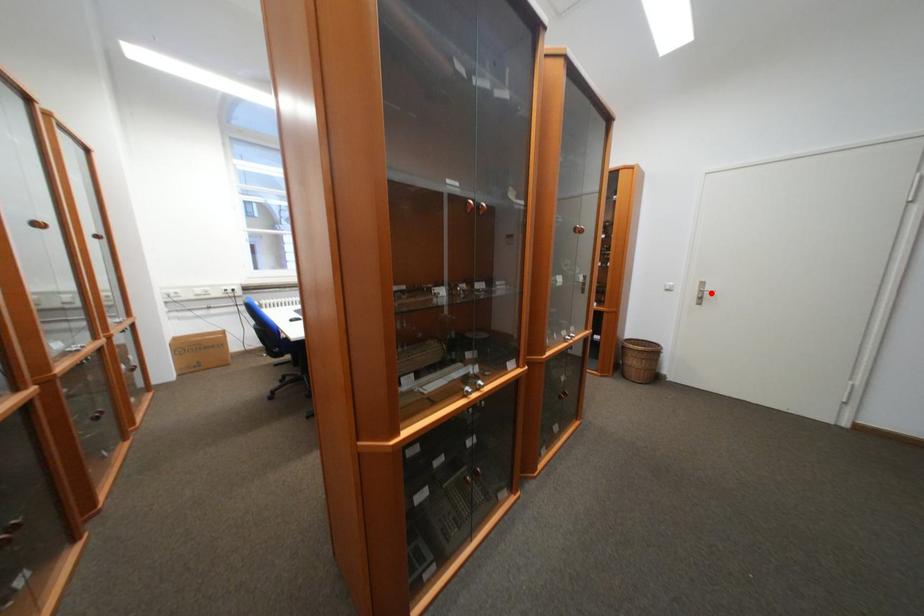
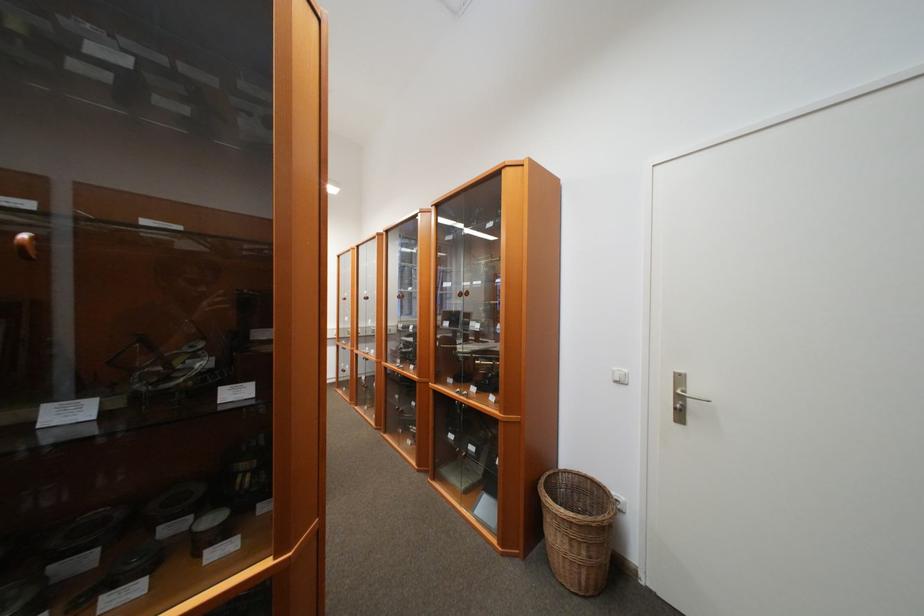
The point at the highlighted location is marked in the first image. Where is the corresponding point in the second image?

(689, 399)